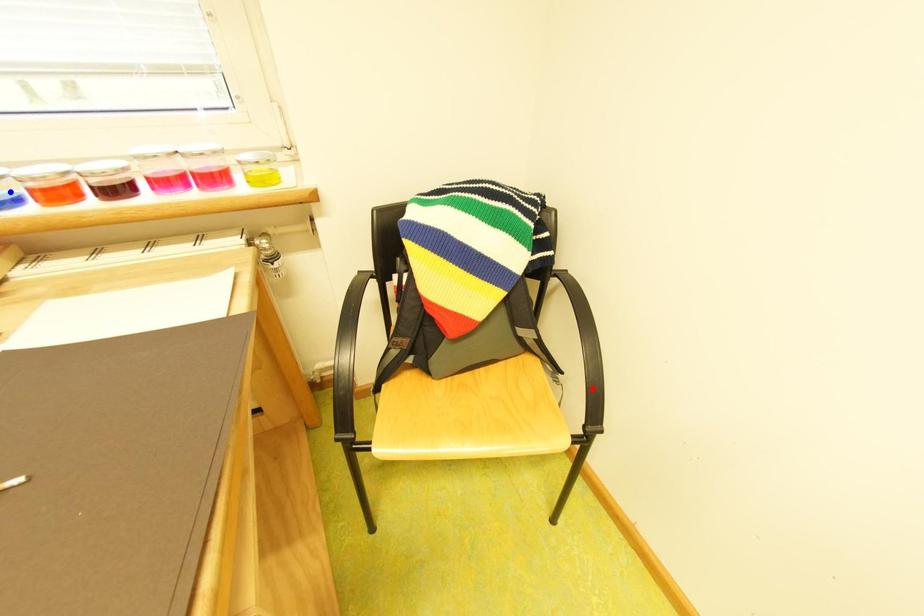
Question: In the image, two points are highlighted. Which point is nearer to the camera? Reply with the corresponding letter.

Choices:
 (A) blue point
 (B) red point

Answer: (A)